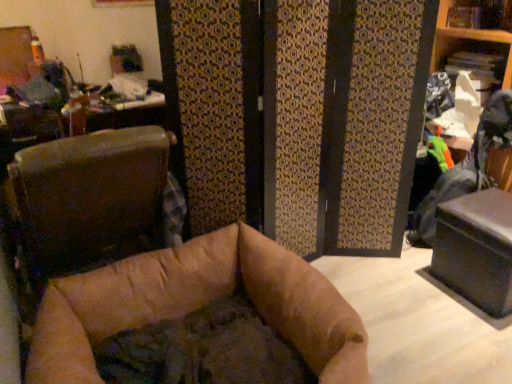
Question: Relative to brown leather chair at left, is black matte table at lower right in front or behind?

Choices:
 (A) behind
 (B) front

Answer: (A)

Question: Based on their sizes in the image, would you say black matte table at lower right is bigger or smaller than brown leather chair at left?

Choices:
 (A) small
 (B) big

Answer: (A)

Question: Considering the positions of point (498, 256) and point (28, 188), is point (498, 256) closer or farther from the camera than point (28, 188)?

Choices:
 (A) closer
 (B) farther

Answer: (B)

Question: Is brown leather chair at left inside or outside of black matte table at lower right?

Choices:
 (A) inside
 (B) outside

Answer: (B)

Question: From the image's perspective, is brown leather chair at left located above or below black matte table at lower right?

Choices:
 (A) above
 (B) below

Answer: (A)

Question: From a real-world perspective, relative to black matte table at lower right, is brown leather chair at left vertically above or below?

Choices:
 (A) below
 (B) above

Answer: (B)

Question: Relative to black matte table at lower right, is brown leather chair at left in front or behind?

Choices:
 (A) front
 (B) behind

Answer: (A)